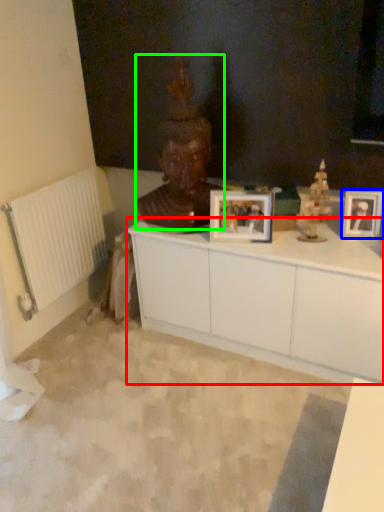
Question: Estimate the real-world distances between objects in this image. Which object is closer to cabinetry (highlighted by a red box), picture frame (highlighted by a blue box) or person (highlighted by a green box)?

Choices:
 (A) picture frame
 (B) person

Answer: (B)